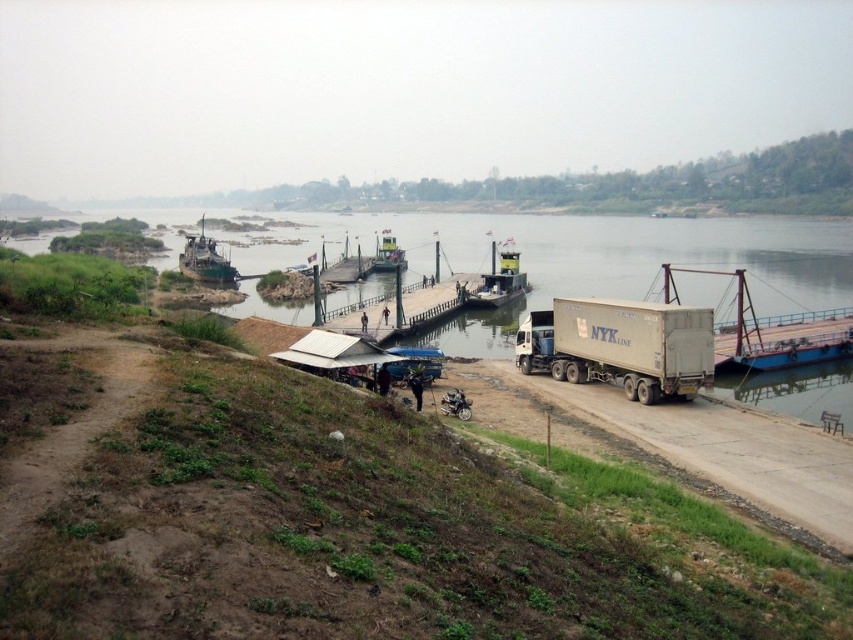
You are a traveler wanting to reach the green plastic boat at center. From your current position at the brown dirt track at lower left, which direction should you move to get there?

The brown dirt track at lower left is positioned on the right side of green plastic boat at center, so you should move to the left to reach the green plastic boat at center.

You are standing at the wooden dock at center and want to cross the river to the opposite bank. Which direction should you head to reach the opposite bank?

To reach the opposite bank from the wooden dock at center, you should head towards the direction where the ferry is located closer to the right, as ferries typically travel between docks on either side of the river.